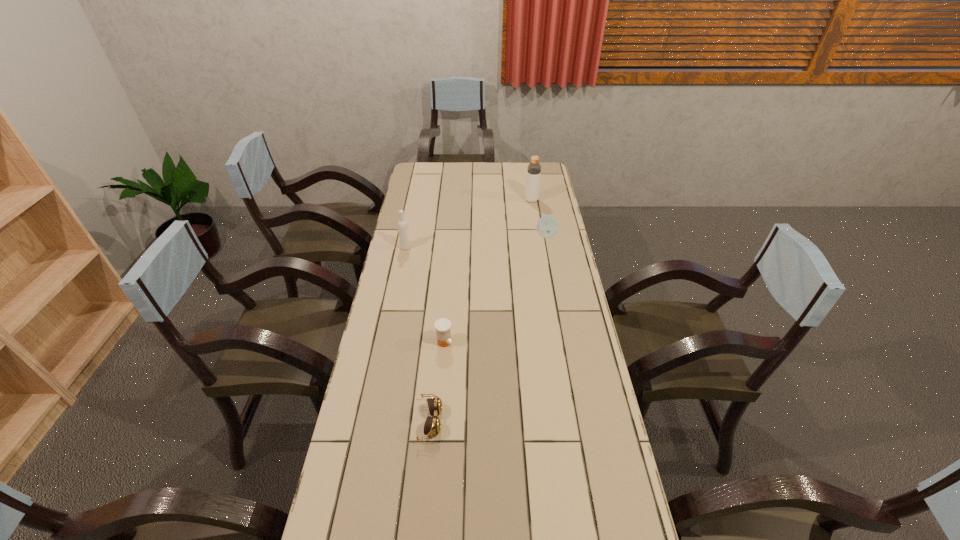
The width and height of the screenshot is (960, 540). Find the location of `the farthest object`. the farthest object is located at coordinates (534, 168).

Identify the location of bottle. The image size is (960, 540). (534, 168).

The image size is (960, 540). What are the coordinates of `the leftmost object` in the screenshot? It's located at (403, 229).

This screenshot has height=540, width=960. I want to click on the fourth shortest object, so click(x=403, y=229).

You are a GUI agent. You are given a task and a screenshot of the screen. Output one action in this format:
    pyautogui.click(x=<x>, y=<y>)
    Task: Click on the second farthest object
    
    Given the screenshot: What is the action you would take?
    pyautogui.click(x=547, y=227)

At what (x,y) coordinates should I click in order to perform the action: click on the second nearest object. Please return your answer as a coordinate pair (x, y). The height and width of the screenshot is (540, 960). Looking at the image, I should click on pos(442,326).

Where is `goggles`? goggles is located at coordinates (432, 426).

Locate an element on the screen. The height and width of the screenshot is (540, 960). the shortest object is located at coordinates (x=432, y=426).

Locate an element on the screen. The width and height of the screenshot is (960, 540). vacant area situated on the back of the tallest object is located at coordinates (530, 191).

At what (x,y) coordinates should I click in order to perform the action: click on vacant area situated 0.170m on the front of the leftmost object. Please return your answer as a coordinate pair (x, y). Image resolution: width=960 pixels, height=540 pixels. Looking at the image, I should click on (399, 278).